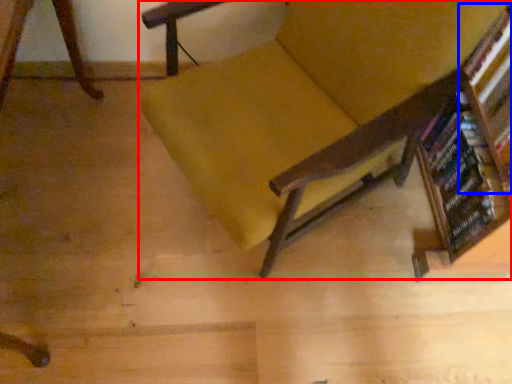
Question: Which object is closer to the camera taking this photo, chair (highlighted by a red box) or shelf (highlighted by a blue box)?

Choices:
 (A) chair
 (B) shelf

Answer: (A)